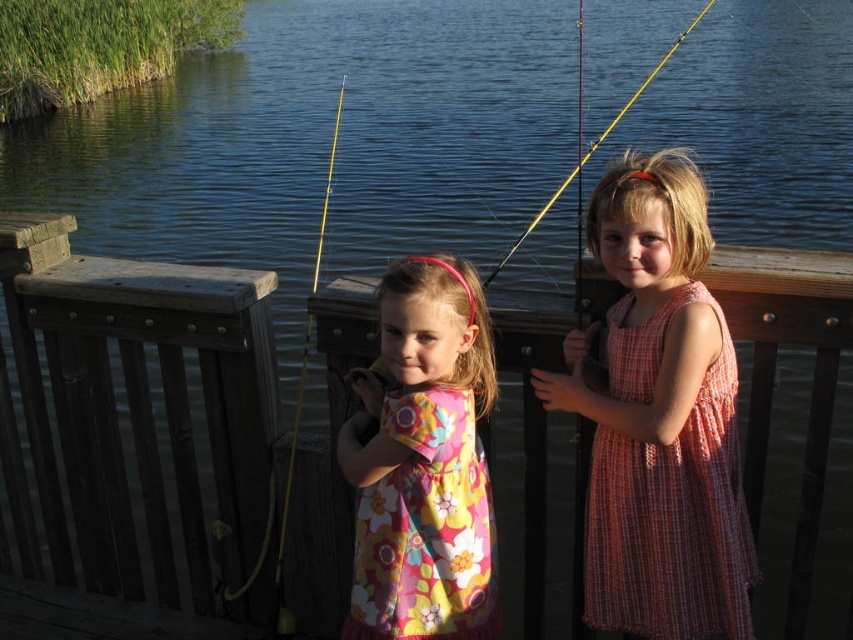
You are a photographer standing at the edge of the wooden deck. You want to take a photo of both the plaid cotton dress at center and the floral fabric dress at center. What is the minimum distance you need to move backward to ensure both dresses are fully in frame?

The plaid cotton dress at center is 18.97 inches away from the floral fabric dress at center. To capture both in the same frame, you need to move back until the camera can encompass the 18.97 inches distance between them. The exact distance depends on the camera lens and sensor size, but moving back at least 2 feet should provide enough space for both dresses to be visible.

You are a photographer trying to capture both the floral fabric dress at center and the yellow plastic fishing rod at center in the same frame. Which object should you focus on first to ensure both are in the frame?

The floral fabric dress at center is not as tall as the yellow plastic fishing rod at center, so you should focus on the taller yellow plastic fishing rod at center first to ensure both are in the frame.

You are a photographer trying to capture both the floral fabric dress at center and the yellow plastic fishing pole at center in a single frame. Which object should you focus on first to ensure it fits better in the frame?

The yellow plastic fishing pole at center occupies more space than the floral fabric dress at center, so focusing on it first would ensure it fits better in the frame.